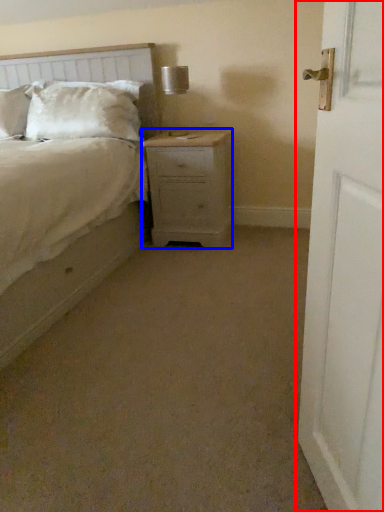
Question: Among these objects, which one is farthest to the camera, door (highlighted by a red box) or nightstand (highlighted by a blue box)?

Choices:
 (A) door
 (B) nightstand

Answer: (B)